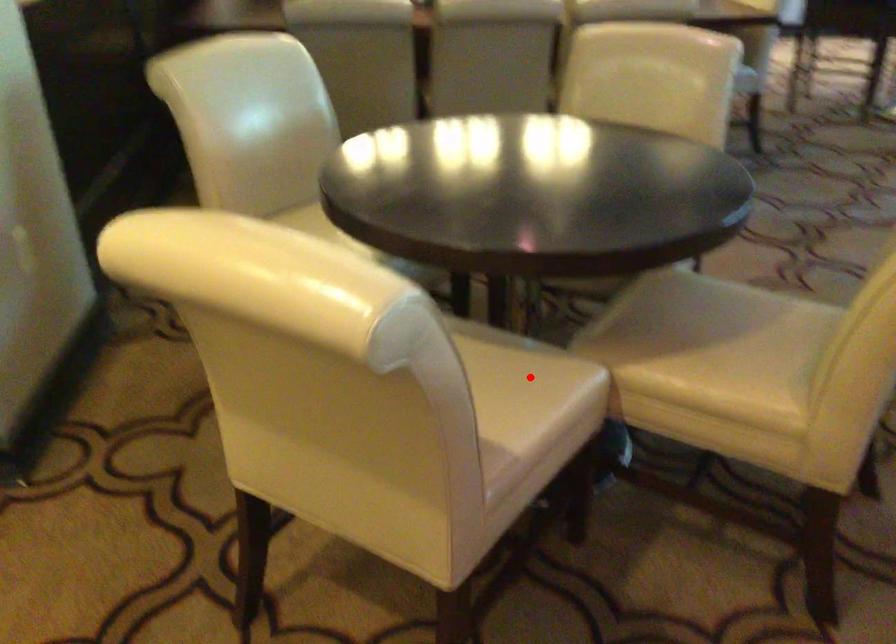
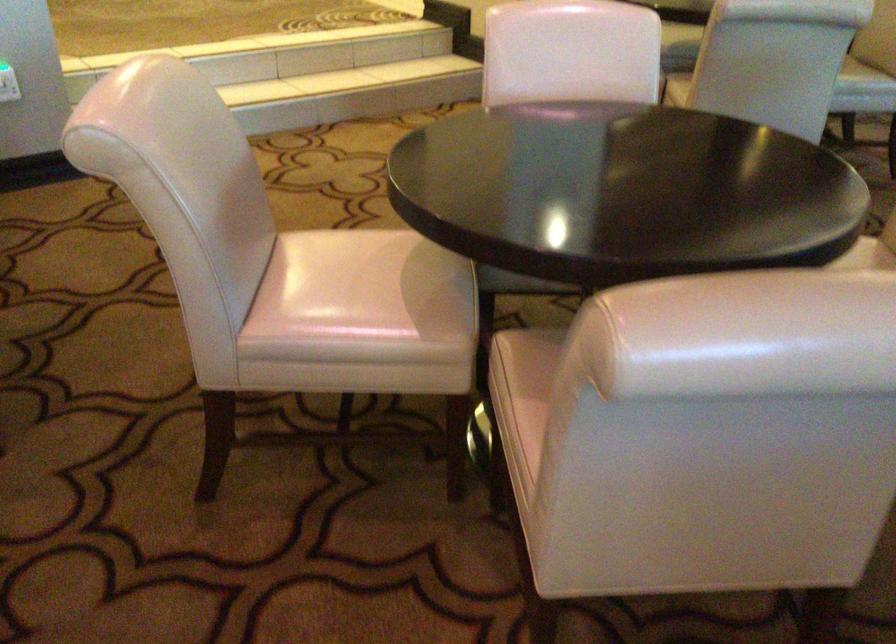
Question: I am providing you with two images of the same scene from different viewpoints. A red point is marked on the first image. Is the red point's position out of view in image 2?

Choices:
 (A) Yes
 (B) No

Answer: (A)